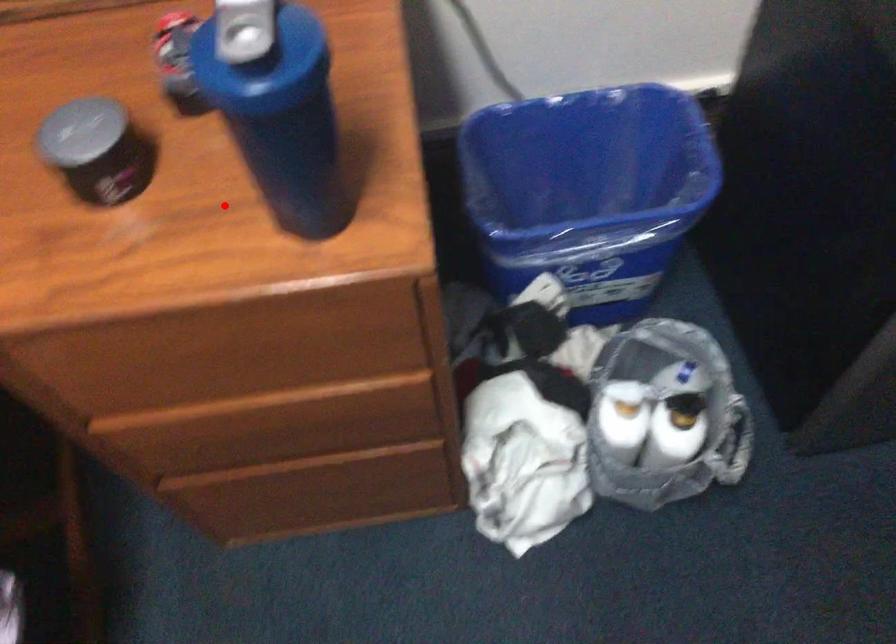
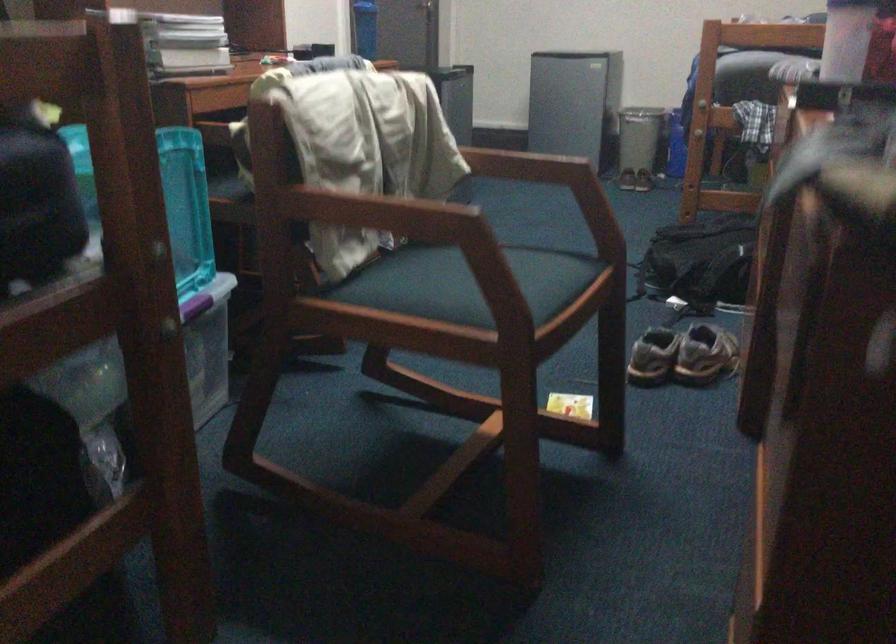
Locate, in the second image, the point that corresponds to the highlighted location in the first image.

(365, 28)